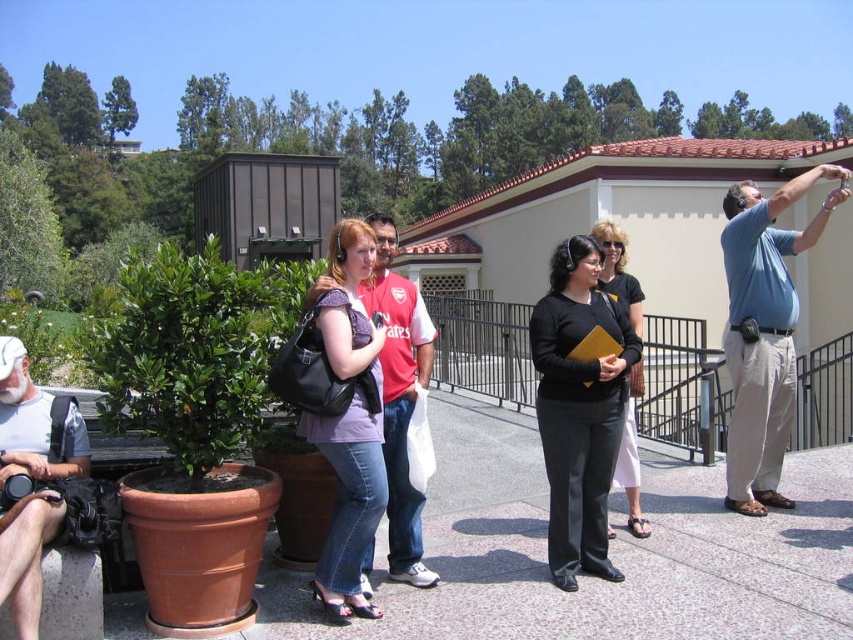
Can you confirm if black matte pants at center is smaller than blue cotton shirt at upper right?

Yes.

Who is more forward, (596, 250) or (746, 496)?

Positioned in front is point (596, 250).

Which is behind, point (602, 573) or point (759, 328)?

Positioned behind is point (759, 328).

I want to click on black matte pants at center, so [579, 408].

Can you confirm if white fabric camera at lower left is positioned to the right of black leather pants at center?

No, white fabric camera at lower left is not to the right of black leather pants at center.

Who is more forward, (25, 600) or (622, 483)?

Point (25, 600) is in front.

Does point (16, 385) lie behind point (624, 467)?

That is False.

Where is `white fabric camera at lower left`? The width and height of the screenshot is (853, 640). white fabric camera at lower left is located at coordinates 35,424.

Does point (368, 486) lie in front of point (20, 561)?

No, it is not.

Where is `denim jeans at center`? Image resolution: width=853 pixels, height=640 pixels. denim jeans at center is located at coordinates (349, 420).